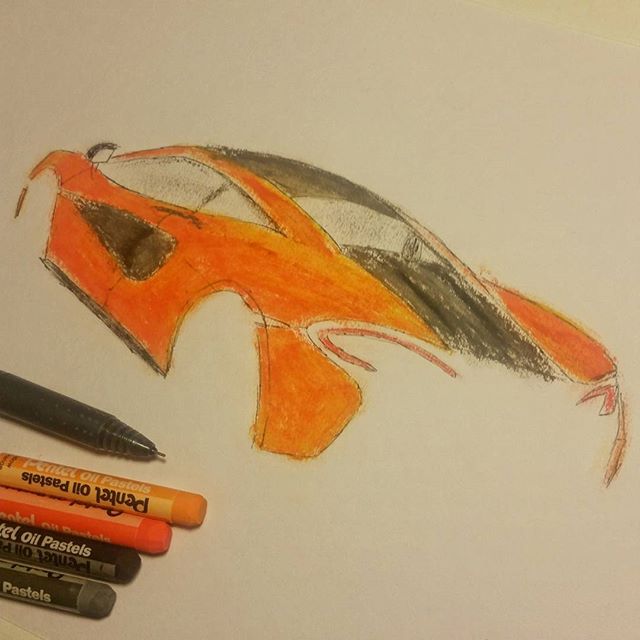
Locate an element on the screen. door handle is located at coordinates (164, 210).